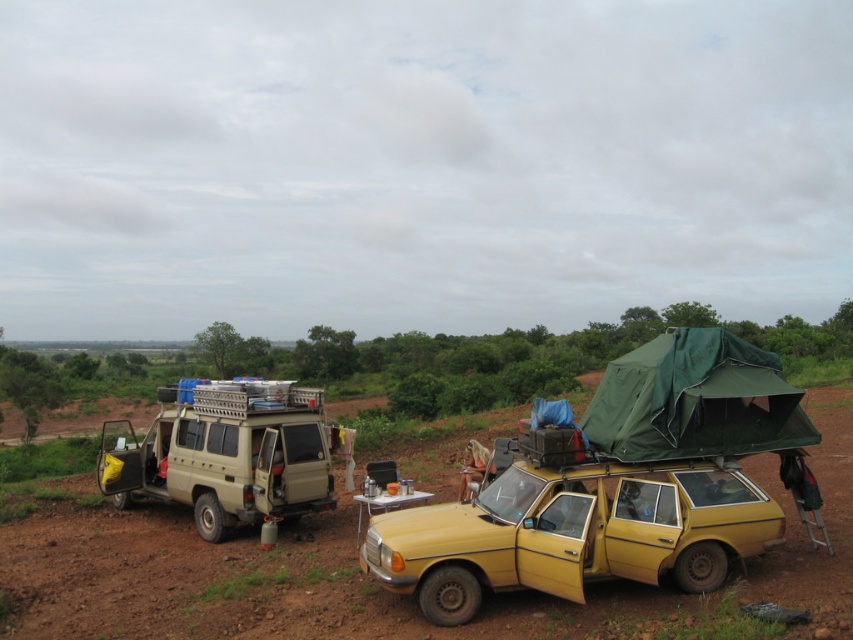
Does brown dirt track at lower left have a larger size compared to beige matte van at left?

Result: Incorrect, brown dirt track at lower left is not larger than beige matte van at left.

Can you confirm if brown dirt track at lower left is smaller than beige matte van at left?

Yes, brown dirt track at lower left is smaller than beige matte van at left.

Between point (61, 484) and point (225, 408), which one is positioned in front?

Positioned in front is point (225, 408).

Identify the location of brown dirt track at lower left. The width and height of the screenshot is (853, 640). (254, 586).

Can you confirm if yellow matte car at center is positioned to the right of green fabric tent at upper right?

Incorrect, yellow matte car at center is not on the right side of green fabric tent at upper right.

Does yellow matte car at center appear over green fabric tent at upper right?

Actually, yellow matte car at center is below green fabric tent at upper right.

You are a GUI agent. You are given a task and a screenshot of the screen. Output one action in this format:
    pyautogui.click(x=<x>, y=<y>)
    Task: Click on the yellow matte car at center
    
    Given the screenshot: What is the action you would take?
    pyautogui.click(x=572, y=532)

Is brown dirt track at lower left smaller than yellow matte car at center?

No.

Does brown dirt track at lower left appear over yellow matte car at center?

Actually, brown dirt track at lower left is below yellow matte car at center.

What do you see at coordinates (254, 586) in the screenshot? Image resolution: width=853 pixels, height=640 pixels. I see `brown dirt track at lower left` at bounding box center [254, 586].

The height and width of the screenshot is (640, 853). I want to click on brown dirt track at lower left, so click(x=254, y=586).